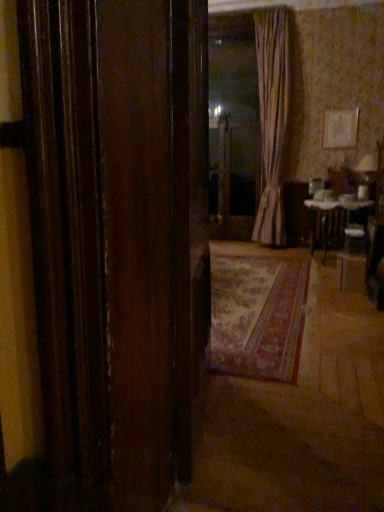
Question: Is wooden door at center thinner than transparent glass door at center?

Choices:
 (A) no
 (B) yes

Answer: (A)

Question: Would you say transparent glass door at center is part of wooden door at center's contents?

Choices:
 (A) no
 (B) yes

Answer: (A)

Question: Does wooden door at center have a greater height compared to transparent glass door at center?

Choices:
 (A) yes
 (B) no

Answer: (B)

Question: From the image's perspective, is wooden door at center located above transparent glass door at center?

Choices:
 (A) no
 (B) yes

Answer: (A)

Question: Does wooden door at center come behind transparent glass door at center?

Choices:
 (A) yes
 (B) no

Answer: (B)

Question: From a real-world perspective, is wooden door at center physically located above or below striped fabric curtain at center?

Choices:
 (A) below
 (B) above

Answer: (A)

Question: Considering the positions of wooden door at center and striped fabric curtain at center in the image, is wooden door at center wider or thinner than striped fabric curtain at center?

Choices:
 (A) thin
 (B) wide

Answer: (B)

Question: From their relative heights in the image, would you say wooden door at center is taller or shorter than striped fabric curtain at center?

Choices:
 (A) short
 (B) tall

Answer: (A)

Question: Would you say wooden door at center is inside or outside striped fabric curtain at center?

Choices:
 (A) inside
 (B) outside

Answer: (B)

Question: Is white glossy table at center wider or thinner than wooden door at center?

Choices:
 (A) thin
 (B) wide

Answer: (B)

Question: Is white glossy table at center to the left or to the right of wooden door at center in the image?

Choices:
 (A) right
 (B) left

Answer: (A)

Question: Choose the correct answer: Is white glossy table at center inside wooden door at center or outside it?

Choices:
 (A) outside
 (B) inside

Answer: (A)

Question: Does point (362, 202) appear closer or farther from the camera than point (205, 29)?

Choices:
 (A) closer
 (B) farther

Answer: (B)

Question: Considering the relative positions of white glossy table at center and striped fabric curtain at center in the image provided, is white glossy table at center to the left or to the right of striped fabric curtain at center?

Choices:
 (A) right
 (B) left

Answer: (A)

Question: Which is correct: white glossy table at center is inside striped fabric curtain at center, or outside of it?

Choices:
 (A) outside
 (B) inside

Answer: (A)